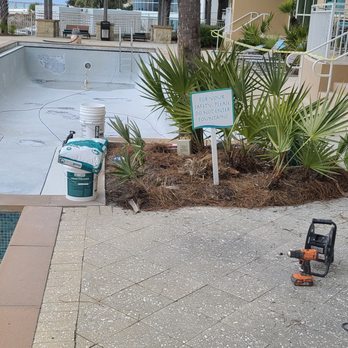
The image size is (348, 348). In order to click on blue square hot tub tiles in this screenshot , I will do `click(2, 227)`.